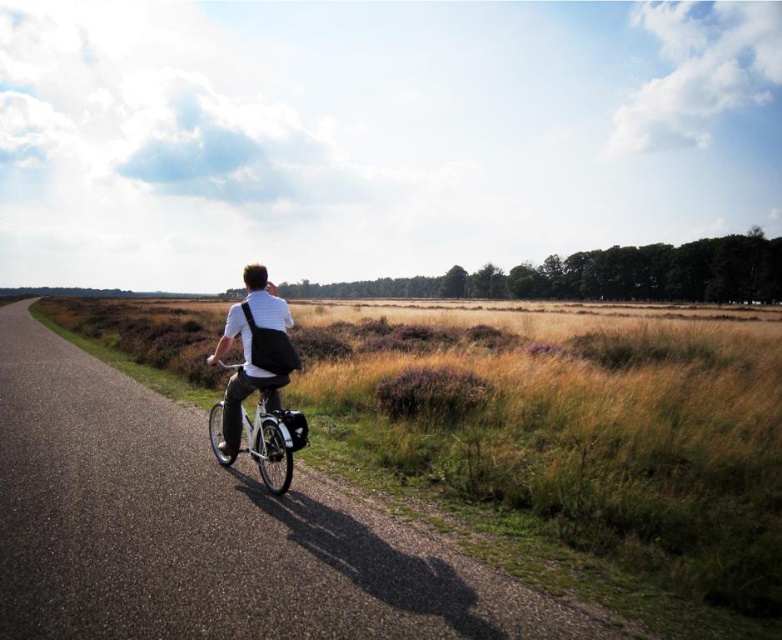
You are a delivery person who needs to place a matte black backpack at center onto the asphalt road at center. Considering their sizes, will the backpack fit entirely on the road without any part hanging off?

The asphalt road at center is bigger than the matte black backpack at center, so yes, the backpack will fit entirely on the road without any part hanging off.

You are a cyclist approaching the asphalt road at center and the matte black backpack at center. Which object will you encounter first?

The asphalt road at center is in front of the matte black backpack at center, so you will encounter the asphalt road at center first.